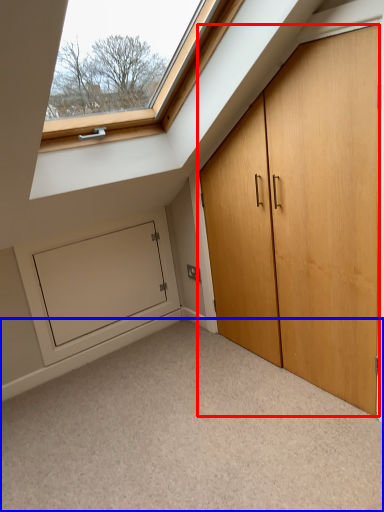
Question: Among these objects, which one is nearest to the camera, door (highlighted by a red box) or corridor (highlighted by a blue box)?

Choices:
 (A) door
 (B) corridor

Answer: (B)